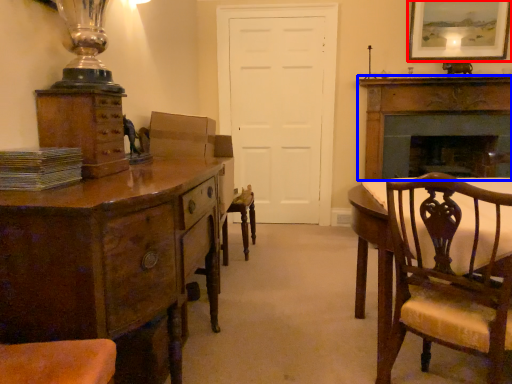
Question: Which object is closer to the camera taking this photo, picture frame (highlighted by a red box) or fireplace (highlighted by a blue box)?

Choices:
 (A) picture frame
 (B) fireplace

Answer: (A)